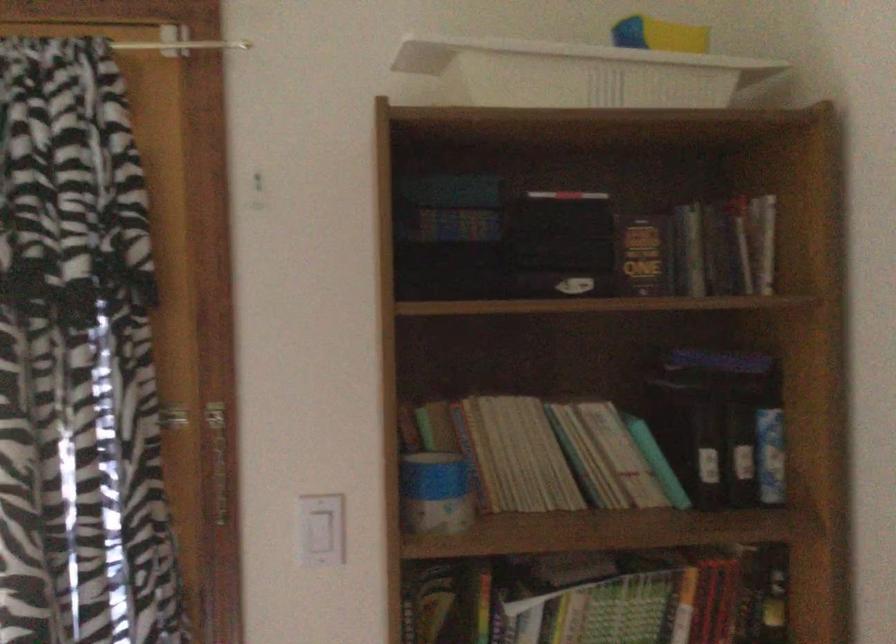
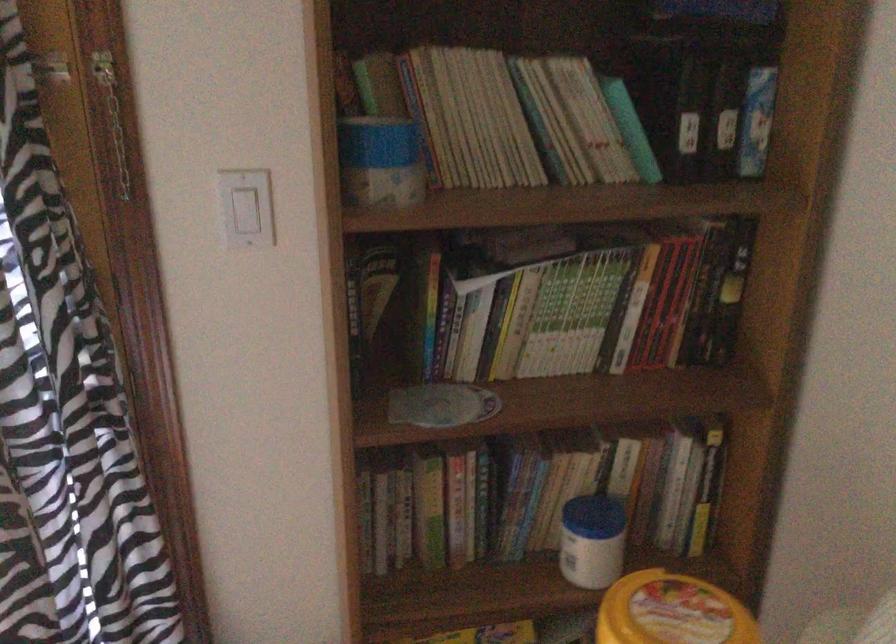
Find the pixel in the second image that matches the point at 487,453 in the first image.

(438, 117)